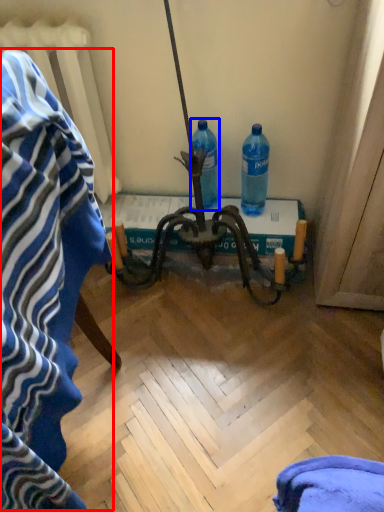
Question: Which of the following is the farthest to the observer, bath towel (highlighted by a red box) or bottle (highlighted by a blue box)?

Choices:
 (A) bath towel
 (B) bottle

Answer: (B)